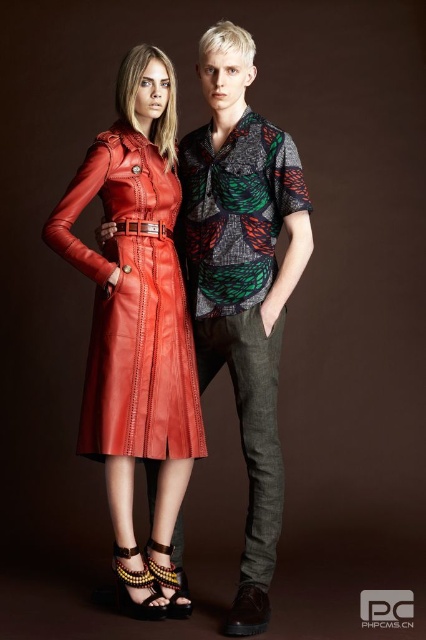
You are a photographer adjusting your camera settings to focus on the matte leather dress at center and the multicolored beaded sandal at lower center. Which object should you focus on first to ensure proper depth of field?

You should focus on the matte leather dress at center first because it is closer to the viewer than the multicolored beaded sandal at lower center, ensuring the depth of field captures both objects clearly.

You are a photographer standing next to a camera. You need to adjust the focus so that both the matte leather dress at center and the camera are in sharp focus. What should you do?

The matte leather dress at center and camera are 6.92 feet apart. To ensure both are in focus, set the focus point between them and use a small aperture for a larger depth of field.